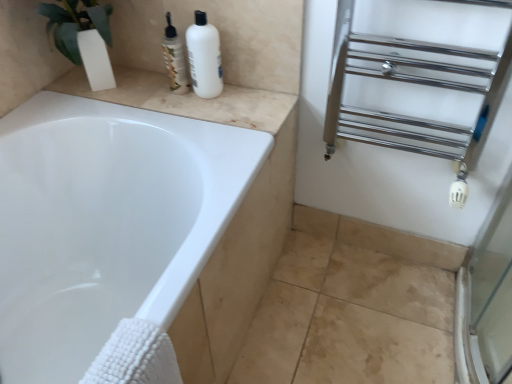
Question: Do you think chrome/metal towel rack at right is within translucent plastic bottles at upper center, or outside of it?

Choices:
 (A) outside
 (B) inside

Answer: (A)

Question: Visually, is chrome/metal towel rack at right positioned to the left or to the right of translucent plastic bottles at upper center?

Choices:
 (A) left
 (B) right

Answer: (B)

Question: Which object is positioned farthest from the white matte bottle at upper center?

Choices:
 (A) chrome/metal towel rack at right
 (B) beige marble counter top at upper left
 (C) translucent plastic bottles at upper center

Answer: (A)

Question: Which object is positioned closest to the translucent plastic bottles at upper center?

Choices:
 (A) chrome/metal towel rack at right
 (B) white matte bottle at upper center
 (C) beige marble counter top at upper left

Answer: (B)